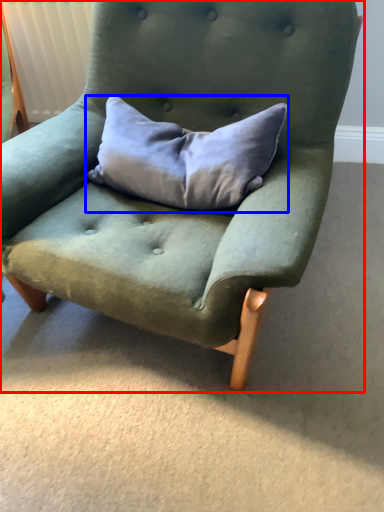
Question: Which object appears closest to the camera in this image, chair (highlighted by a red box) or pillow (highlighted by a blue box)?

Choices:
 (A) chair
 (B) pillow

Answer: (A)